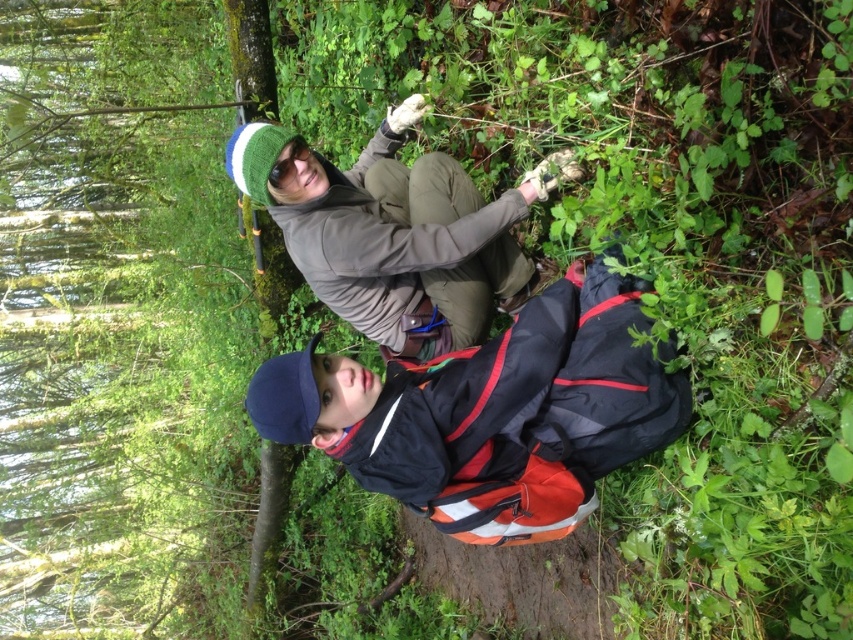
Question: Is reflective blue jacket at lower center to the left of matte gray jacket at upper center from the viewer's perspective?

Choices:
 (A) yes
 (B) no

Answer: (B)

Question: Which point is closer to the camera taking this photo?

Choices:
 (A) (410, 278)
 (B) (355, 460)

Answer: (B)

Question: Among these objects, which one is nearest to the camera?

Choices:
 (A) matte gray jacket at upper center
 (B) reflective blue jacket at lower center

Answer: (B)

Question: Considering the relative positions of reflective blue jacket at lower center and matte gray jacket at upper center in the image provided, where is reflective blue jacket at lower center located with respect to matte gray jacket at upper center?

Choices:
 (A) above
 (B) below

Answer: (B)

Question: Which object is closer to the camera taking this photo?

Choices:
 (A) reflective blue jacket at lower center
 (B) matte gray jacket at upper center

Answer: (A)

Question: Observing the image, what is the correct spatial positioning of reflective blue jacket at lower center in reference to matte gray jacket at upper center?

Choices:
 (A) below
 (B) above

Answer: (A)